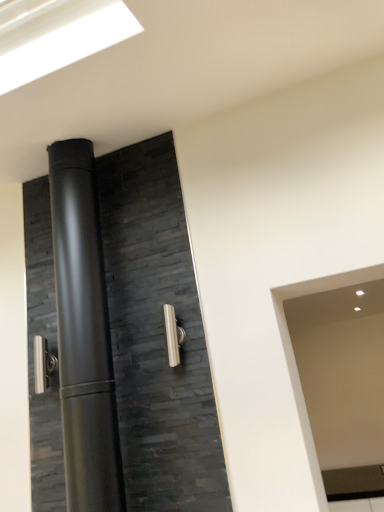
Question: In terms of width, does satin nickel door handle at left, the 1th door handle when ordered from back to front, look wider or thinner when compared to satin nickel door handle at center, the 1th door handle positioned from the right?

Choices:
 (A) thin
 (B) wide

Answer: (B)

Question: Looking at the image, does satin nickel door handle at left, the 1th door handle when ordered from back to front, seem bigger or smaller compared to satin nickel door handle at center, which is the 1th door handle from front to back?

Choices:
 (A) big
 (B) small

Answer: (A)

Question: Based on their relative distances, which object is farther from the satin nickel door handle at center, placed as the 2th door handle when sorted from back to front?

Choices:
 (A) satin nickel door handle at left, the second door handle from the front
 (B) matte black door at center

Answer: (A)

Question: Which of these objects is positioned closest to the satin nickel door handle at center, arranged as the second door handle when viewed from the left?

Choices:
 (A) matte black door at center
 (B) satin nickel door handle at left, the 1th door handle when ordered from back to front

Answer: (A)